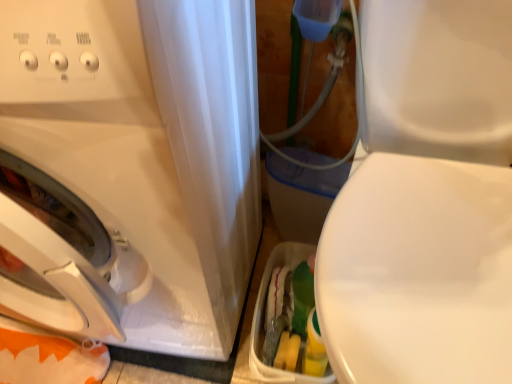
Question: Is white glossy washing machine at left facing towards white glossy toilet at right?

Choices:
 (A) yes
 (B) no

Answer: (B)

Question: Is white glossy washing machine at left closer to camera compared to white glossy toilet at right?

Choices:
 (A) yes
 (B) no

Answer: (B)

Question: Can we say white glossy washing machine at left lies outside white glossy toilet at right?

Choices:
 (A) yes
 (B) no

Answer: (A)

Question: Is white glossy washing machine at left smaller than white glossy toilet at right?

Choices:
 (A) yes
 (B) no

Answer: (B)

Question: From a real-world perspective, does white glossy washing machine at left sit lower than white glossy toilet at right?

Choices:
 (A) yes
 (B) no

Answer: (B)

Question: Is white glossy washing machine at left oriented away from white glossy toilet at right?

Choices:
 (A) yes
 (B) no

Answer: (B)

Question: Can you confirm if white glossy toilet at right is smaller than white glossy washing machine at left?

Choices:
 (A) no
 (B) yes

Answer: (B)

Question: Can you confirm if white glossy toilet at right is taller than white glossy washing machine at left?

Choices:
 (A) no
 (B) yes

Answer: (A)

Question: Does white glossy toilet at right lie in front of white glossy washing machine at left?

Choices:
 (A) yes
 (B) no

Answer: (A)

Question: Is white glossy washing machine at left located within white glossy toilet at right?

Choices:
 (A) yes
 (B) no

Answer: (B)

Question: Is white glossy washing machine at left at the back of white glossy toilet at right?

Choices:
 (A) no
 (B) yes

Answer: (A)

Question: Considering the relative sizes of white glossy toilet at right and white glossy washing machine at left in the image provided, is white glossy toilet at right thinner than white glossy washing machine at left?

Choices:
 (A) yes
 (B) no

Answer: (B)

Question: From a real-world perspective, is white glossy washing machine at left physically located above or below white glossy toilet at right?

Choices:
 (A) below
 (B) above

Answer: (B)